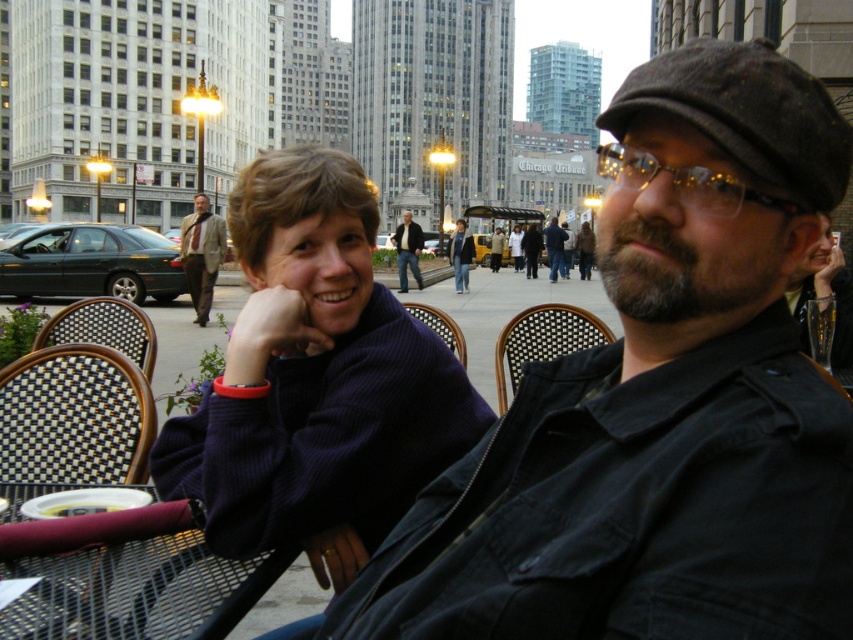
You are a photographer trying to capture the two people sitting at the outdoor cafe table. Since both the light brown suit at center and jeans at center are in the frame, which clothing item is covering the other?

The light brown suit at center is positioned over jeans at center, so the light brown suit at center is covering the jeans at center.

You are a photographer trying to capture a cityscape with the black matte glass at upper right. Based on its position, where should you aim your camera to include it in the frame?

The black matte glass at upper right is located at coordinates point (824, 294), so you should aim your camera slightly to the upper right to include it in the frame.